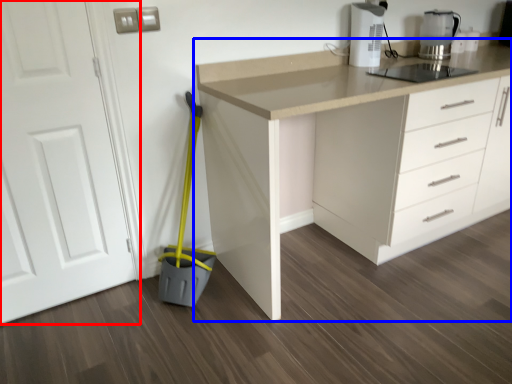
Question: Which of the following is the closest to the observer, door (highlighted by a red box) or countertop (highlighted by a blue box)?

Choices:
 (A) door
 (B) countertop

Answer: (A)